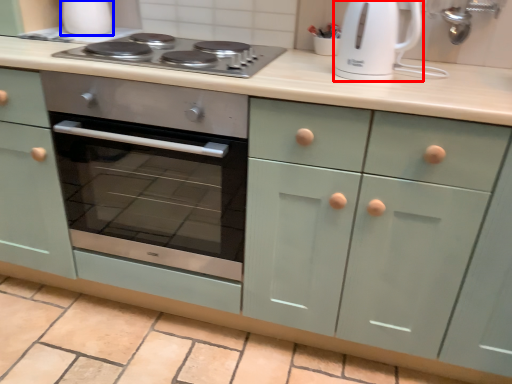
Question: Which object appears farthest to the camera in this image, kitchen appliance (highlighted by a red box) or appliance (highlighted by a blue box)?

Choices:
 (A) kitchen appliance
 (B) appliance

Answer: (B)